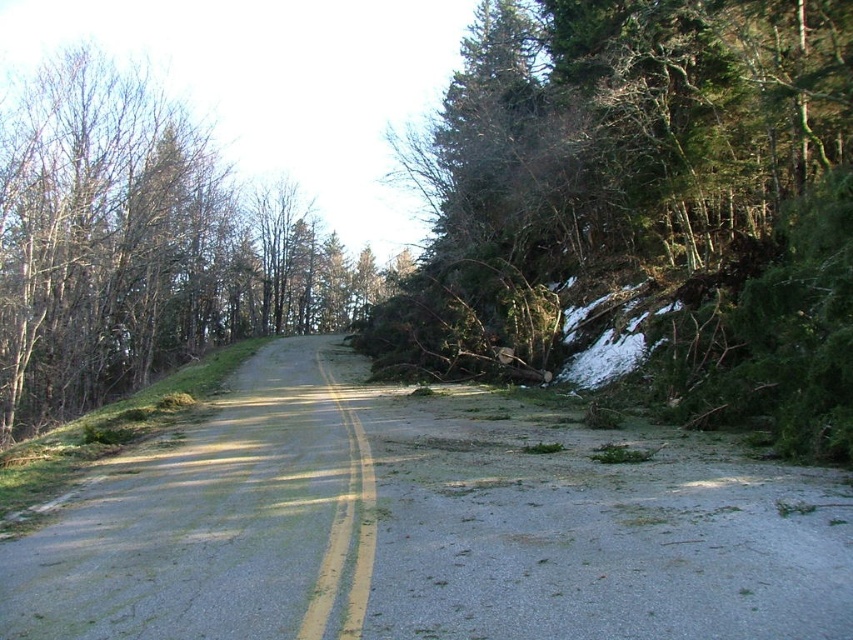
Looking at this image, you are a construction worker assessing the road condition. You notice the gray asphalt road at center and the smooth asphalt road at center. Which one is higher in elevation?

The gray asphalt road at center is above the smooth asphalt road at center, so it is higher in elevation.

From the picture: You are a hiker who wants to take a shortcut through the road. There is a point marked at coordinates (138, 246). Is this point on the debris on the right side of the road or on the green leafy tree at left?

The point (138, 246) is on the green leafy tree at left, so it is not on the debris on the right side of the road.